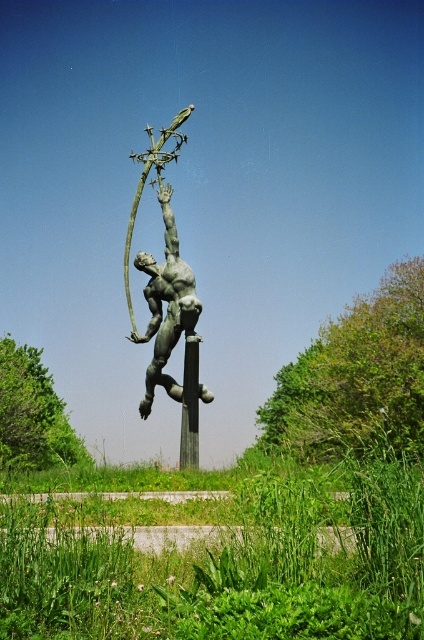
Question: Can you confirm if green leafy tree at left is positioned to the right of green polished stone pole at center?

Choices:
 (A) yes
 (B) no

Answer: (B)

Question: Is green leafy tree at center above green leafy tree at left?

Choices:
 (A) yes
 (B) no

Answer: (A)

Question: Which point is farther from the camera taking this photo?

Choices:
 (A) (27, 368)
 (B) (421, 378)

Answer: (A)

Question: Does bronze statue at center appear on the left side of green polished stone pole at center?

Choices:
 (A) yes
 (B) no

Answer: (A)

Question: Among these objects, which one is nearest to the camera?

Choices:
 (A) bronze statue at center
 (B) green leafy tree at center
 (C) green leafy tree at left
 (D) green polished stone pole at center

Answer: (A)

Question: Which object appears closest to the camera in this image?

Choices:
 (A) bronze statue at center
 (B) green polished stone pole at center

Answer: (A)